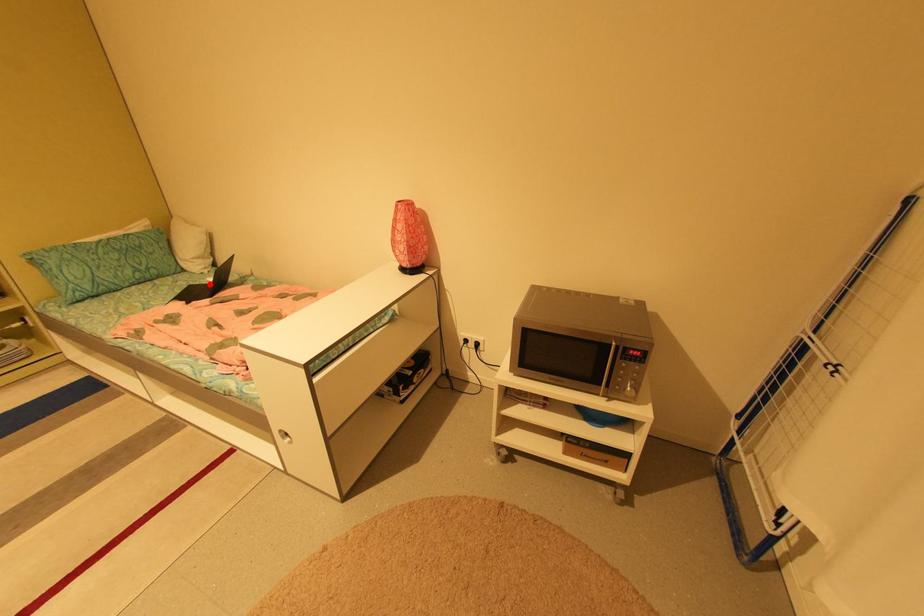
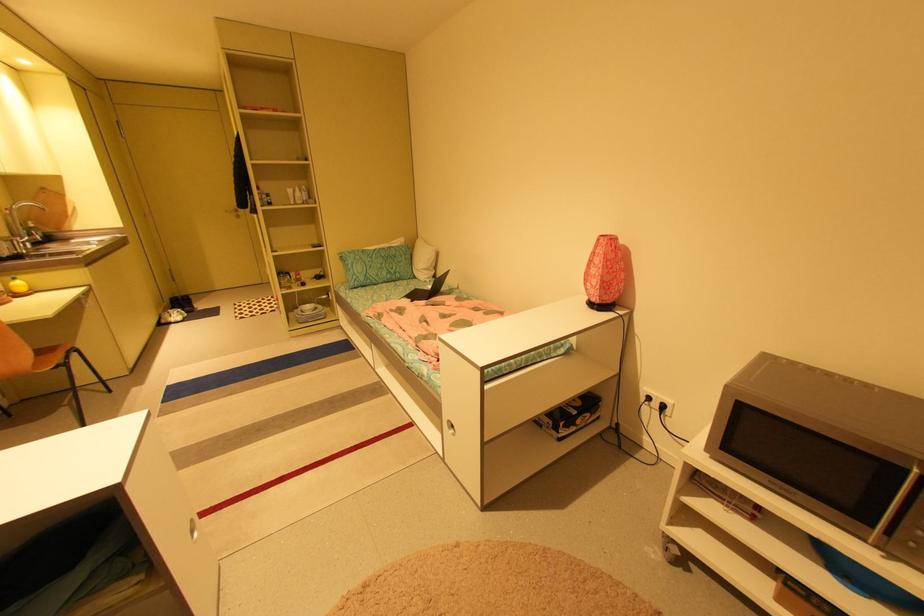
Find the pixel in the second image that matches the highlighted location in the first image.

(431, 290)